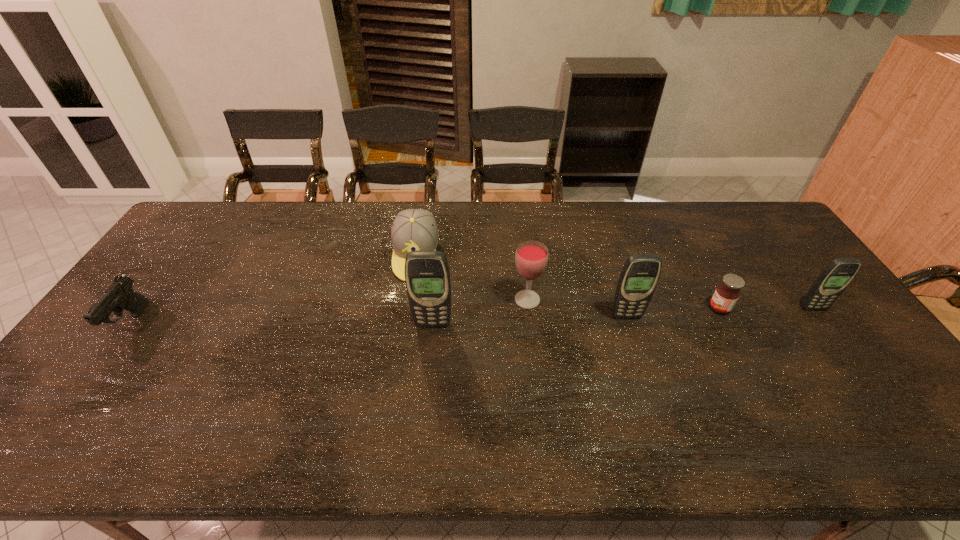
The width and height of the screenshot is (960, 540). I want to click on free region located on the screen of the second nearest cellular telephone, so click(651, 395).

Locate an element on the screen. The image size is (960, 540). vacant point located 0.090m on the screen of the rightmost object is located at coordinates (832, 336).

Locate an element on the screen. The image size is (960, 540). vacant area situated 0.240m on the front of the fourth object from right to left is located at coordinates click(x=536, y=383).

At what (x,y) coordinates should I click in order to perform the action: click on free location located on the front-facing side of the farthest object. Please return your answer as a coordinate pair (x, y). The image size is (960, 540). Looking at the image, I should click on (409, 296).

Identify the location of vacant position located at the barrel of the leftmost object. (90, 379).

Locate an element on the screen. The height and width of the screenshot is (540, 960). free point located on the label side of the sixth object from left to right is located at coordinates (633, 308).

Locate an element on the screen. Image resolution: width=960 pixels, height=540 pixels. free space located on the label side of the sixth object from left to right is located at coordinates (687, 308).

What are the coordinates of `free point located on the label side of the sixth object from left to right` in the screenshot? It's located at (618, 308).

Find the location of a particular element. The width and height of the screenshot is (960, 540). object that is at the far edge is located at coordinates (413, 229).

I want to click on object at the left edge, so click(x=119, y=295).